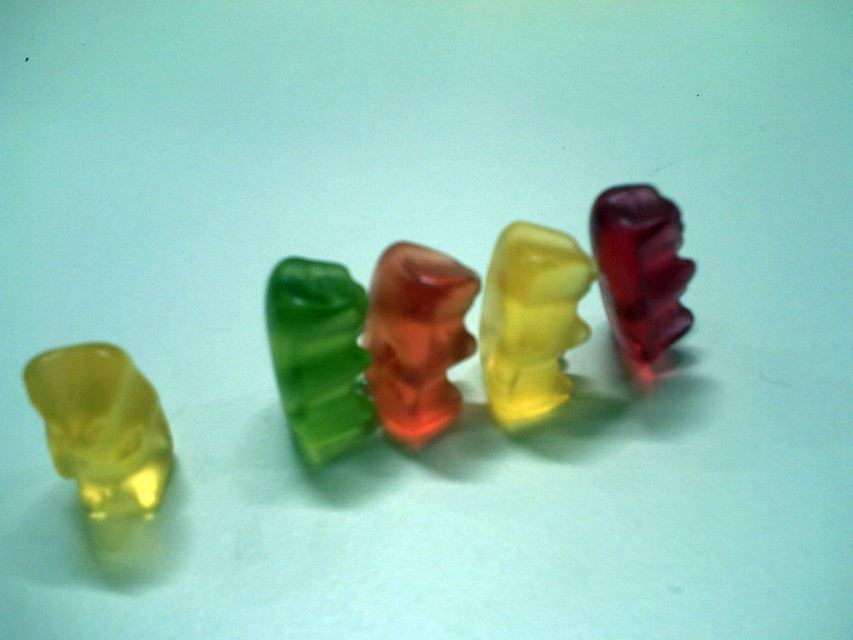
Consider the image. Who is more forward, (403, 440) or (675, 273)?

Point (403, 440) is more forward.

Who is taller, translucent red bear at center or translucent red gummy bear at right?

With more height is translucent red gummy bear at right.

Which is behind, point (370, 392) or point (670, 269)?

Positioned behind is point (670, 269).

Identify the location of translucent red bear at center. This screenshot has width=853, height=640. (416, 339).

Does translucent yellow bear at left have a greater height compared to translucent red gummy bear at right?

In fact, translucent yellow bear at left may be shorter than translucent red gummy bear at right.

Which is behind, point (57, 410) or point (606, 275)?

The point (606, 275) is more distant.

Who is more distant from viewer, (x=51, y=396) or (x=624, y=326)?

Positioned behind is point (x=624, y=326).

The width and height of the screenshot is (853, 640). Identify the location of translucent yellow bear at left. (102, 428).

Is translucent yellow bear at left shorter than translucent red bear at center?

Correct, translucent yellow bear at left is not as tall as translucent red bear at center.

Between point (131, 403) and point (434, 352), which one is positioned in front?

Point (131, 403) is more forward.

The height and width of the screenshot is (640, 853). Describe the element at coordinates (102, 428) in the screenshot. I see `translucent yellow bear at left` at that location.

I want to click on translucent yellow bear at left, so click(x=102, y=428).